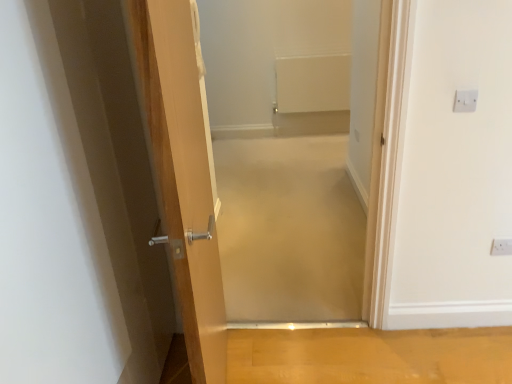
Question: Is beige carpet at center, the 1th corridor from the front, touching white plastic electric outlet at upper right, which is the second electric outlet in front-to-back order?

Choices:
 (A) no
 (B) yes

Answer: (A)

Question: Is there a large distance between beige carpet at center, which ranks as the second corridor in back-to-front order, and white plastic electric outlet at upper right, which is the second electric outlet in front-to-back order?

Choices:
 (A) yes
 (B) no

Answer: (A)

Question: Is beige carpet at center, which ranks as the second corridor in back-to-front order, shorter than white plastic electric outlet at upper right, which is counted as the 1th electric outlet, starting from the bottom?

Choices:
 (A) no
 (B) yes

Answer: (A)

Question: Considering the relative sizes of beige carpet at center, the 1th corridor from the front, and white plastic electric outlet at upper right, which is the first electric outlet from right to left, in the image provided, is beige carpet at center, the 1th corridor from the front, wider than white plastic electric outlet at upper right, which is the first electric outlet from right to left,?

Choices:
 (A) yes
 (B) no

Answer: (A)

Question: Is beige carpet at center, the 1th corridor from the front, to the right of white plastic electric outlet at upper right, which is the 1th electric outlet from back to front, from the viewer's perspective?

Choices:
 (A) yes
 (B) no

Answer: (B)

Question: From a real-world perspective, is beige carpet at center, the 1th corridor from the front, beneath white plastic electric outlet at upper right, the 2th electric outlet in the top-to-bottom sequence?

Choices:
 (A) yes
 (B) no

Answer: (B)

Question: Does beige carpet at center, placed as the 1th corridor when sorted from back to front, have a larger size compared to white plastic electric outlet at upper right, which is the second electric outlet in front-to-back order?

Choices:
 (A) no
 (B) yes

Answer: (B)

Question: Does beige carpet at center, placed as the 1th corridor when sorted from back to front, lie in front of white plastic electric outlet at upper right, which is counted as the 2th electric outlet, starting from the left?

Choices:
 (A) no
 (B) yes

Answer: (A)

Question: Is beige carpet at center, placed as the 1th corridor when sorted from back to front, located outside white plastic electric outlet at upper right, which is the 1th electric outlet from back to front?

Choices:
 (A) yes
 (B) no

Answer: (A)

Question: From the image's perspective, is beige carpet at center, which appears as the 2th corridor when viewed from the front, above white plastic electric outlet at upper right, which is counted as the 1th electric outlet, starting from the bottom?

Choices:
 (A) yes
 (B) no

Answer: (A)

Question: From the image's perspective, does beige carpet at center, placed as the 1th corridor when sorted from back to front, appear lower than white plastic electric outlet at upper right, the 2th electric outlet in the top-to-bottom sequence?

Choices:
 (A) no
 (B) yes

Answer: (A)

Question: From a real-world perspective, is beige carpet at center, which appears as the 2th corridor when viewed from the front, on top of white plastic electric outlet at upper right, which is the first electric outlet from right to left?

Choices:
 (A) no
 (B) yes

Answer: (A)

Question: Is white plastic electric outlet at upper right, the second electric outlet from the back, shorter than beige carpet at center, placed as the 1th corridor when sorted from back to front?

Choices:
 (A) yes
 (B) no

Answer: (B)